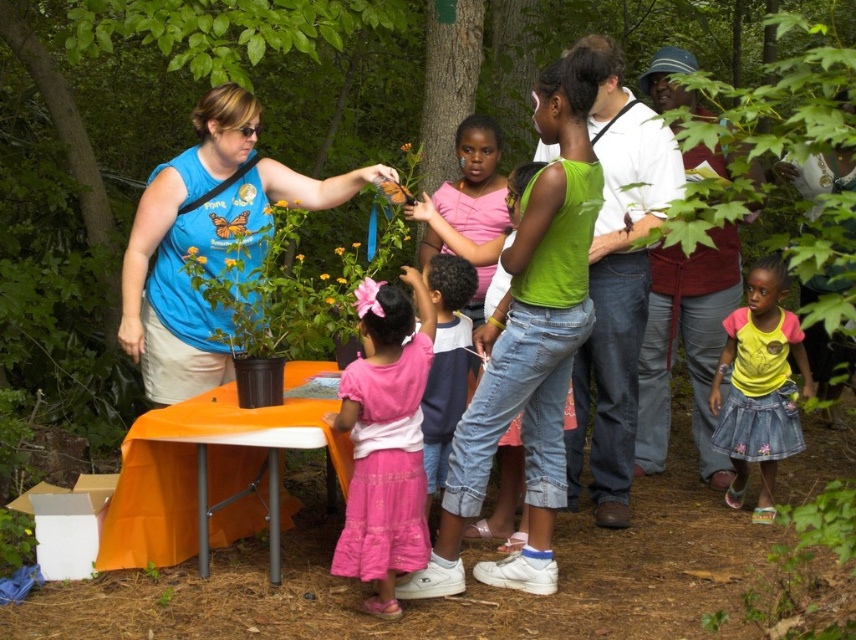
Is orange fabric picnic table at center wider than yellow denim skirt at lower right?

Yes.

Between orange fabric picnic table at center and yellow denim skirt at lower right, which one is positioned lower?

orange fabric picnic table at center is below.

Image resolution: width=856 pixels, height=640 pixels. In order to click on orange fabric picnic table at center in this screenshot , I will do `click(209, 477)`.

Is green matte tank top at center closer to the viewer compared to pink satin dress at center?

No, green matte tank top at center is further to the viewer.

Does green matte tank top at center come behind pink satin dress at center?

Yes, it is.

Locate an element on the screen. The image size is (856, 640). green matte tank top at center is located at coordinates (617, 284).

This screenshot has height=640, width=856. What are the coordinates of `green matte tank top at center` in the screenshot? It's located at click(x=617, y=284).

Between blue t-shirt at center and pink satin dress at center, which one is positioned lower?

Positioned lower is pink satin dress at center.

Who is more forward, (x=247, y=232) or (x=379, y=536)?

Positioned in front is point (x=379, y=536).

The height and width of the screenshot is (640, 856). I want to click on blue t-shirt at center, so click(206, 241).